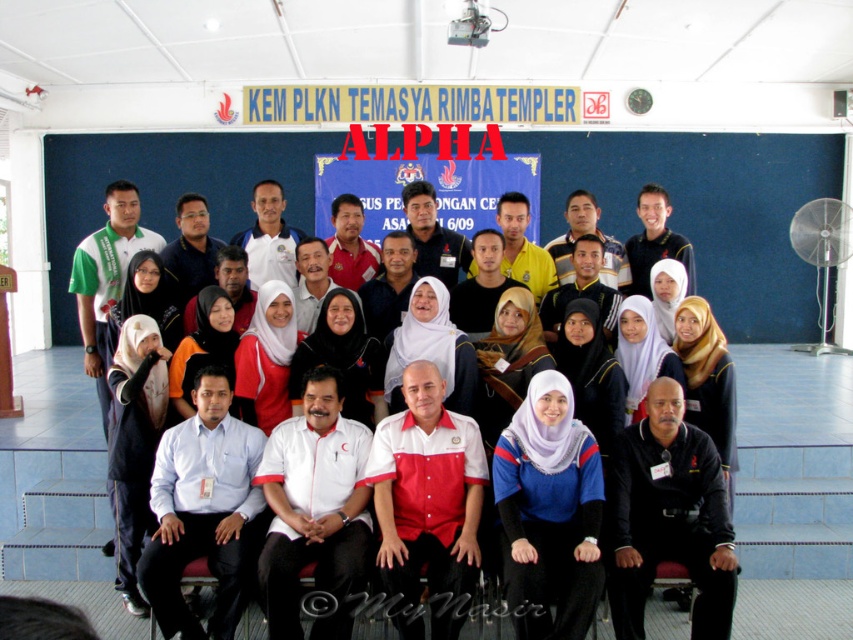
Question: Does black matte shirt at lower right have a smaller size compared to white matte shirt at center?

Choices:
 (A) yes
 (B) no

Answer: (A)

Question: Does blue jersey at center have a lesser width compared to white matte shirt at center?

Choices:
 (A) no
 (B) yes

Answer: (B)

Question: Which object is farther from the camera taking this photo?

Choices:
 (A) black matte shirt at lower right
 (B) white matte shirt at center
 (C) light blue shirt at center

Answer: (C)

Question: Considering the real-world distances, which object is farthest from the light blue shirt at center?

Choices:
 (A) blue jersey at center
 (B) black matte shirt at lower right
 (C) white matte shirt at center

Answer: (B)

Question: Which object appears closest to the camera in this image?

Choices:
 (A) blue jersey at center
 (B) black matte shirt at lower right

Answer: (A)

Question: Does blue jersey at center appear under light blue shirt at center?

Choices:
 (A) yes
 (B) no

Answer: (A)